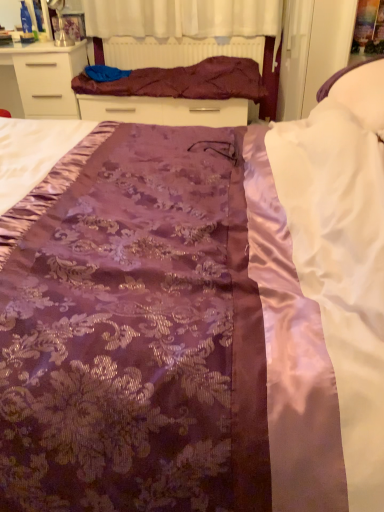
Describe the element at coordinates (41, 79) in the screenshot. I see `matte white chest of drawers at upper left` at that location.

This screenshot has height=512, width=384. What are the coordinates of `purple satin blanket at upper center` in the screenshot? It's located at (184, 81).

Where is `matte white chest of drawers at upper left`? This screenshot has width=384, height=512. matte white chest of drawers at upper left is located at coordinates (41, 79).

Based on the photo, considering the relative sizes of purple satin blanket at upper center and matte white chest of drawers at upper left in the image provided, is purple satin blanket at upper center smaller than matte white chest of drawers at upper left?

Yes.

Is purple satin blanket at upper center closer to the viewer compared to matte white chest of drawers at upper left?

Yes, purple satin blanket at upper center is in front of matte white chest of drawers at upper left.

From their relative heights in the image, would you say purple satin blanket at upper center is taller or shorter than matte white chest of drawers at upper left?

Clearly, purple satin blanket at upper center is shorter compared to matte white chest of drawers at upper left.

Considering the relative sizes of white satin pillow at upper right and purple satin blanket at upper center in the image provided, is white satin pillow at upper right thinner than purple satin blanket at upper center?

Indeed, white satin pillow at upper right has a lesser width compared to purple satin blanket at upper center.

Considering the sizes of white satin pillow at upper right and purple satin blanket at upper center in the image, is white satin pillow at upper right taller or shorter than purple satin blanket at upper center?

In the image, white satin pillow at upper right appears to be taller than purple satin blanket at upper center.

How many degrees apart are the facing directions of white satin pillow at upper right and purple satin blanket at upper center?

white satin pillow at upper right and purple satin blanket at upper center are facing 90.4 degrees away from each other.

From a real-world perspective, between white satin pillow at upper right and purple satin blanket at upper center, who is vertically lower?

From a 3D spatial view, purple satin blanket at upper center is below.

From a real-world perspective, is purple satin blanket at upper center located higher than purple satin bed frame at upper center?

Indeed, from a real-world perspective, purple satin blanket at upper center stands above purple satin bed frame at upper center.

From the image's perspective, which is above, purple satin blanket at upper center or purple satin bed frame at upper center?

purple satin bed frame at upper center appears higher in the image.

Between purple satin blanket at upper center and purple satin bed frame at upper center, which one has more height?

With more height is purple satin bed frame at upper center.

In the scene shown: Could you tell me if purple satin bed frame at upper center is facing purple satin blanket at upper center?

Yes, purple satin bed frame at upper center faces towards purple satin blanket at upper center.

How much distance is there between purple satin bed frame at upper center and purple satin blanket at upper center?

purple satin bed frame at upper center is 15.29 inches away from purple satin blanket at upper center.

Between purple satin bed frame at upper center and purple satin blanket at upper center, which one is positioned behind?

purple satin bed frame at upper center.

Who is taller, purple satin bed frame at upper center or purple satin blanket at upper center?

Standing taller between the two is purple satin bed frame at upper center.

From a real-world perspective, which object stands above the other?

white satin pillow at upper right is physically above.

From the image's perspective, is white satin pillow at upper right on purple satin bed frame at upper center?

Incorrect, from the image's perspective, white satin pillow at upper right is lower than purple satin bed frame at upper center.

Is purple satin bed frame at upper center at the back of white satin pillow at upper right?

No, white satin pillow at upper right is not facing the opposite direction of purple satin bed frame at upper center.

Is white satin pillow at upper right to the right of purple satin bed frame at upper center from the viewer's perspective?

Yes, white satin pillow at upper right is to the right of purple satin bed frame at upper center.

From a real-world perspective, between matte white chest of drawers at upper left and white satin pillow at upper right, who is vertically higher?

white satin pillow at upper right, from a real-world perspective.

Which object is further away from the camera, matte white chest of drawers at upper left or white satin pillow at upper right?

matte white chest of drawers at upper left is behind.

You are a GUI agent. You are given a task and a screenshot of the screen. Output one action in this format:
    pyautogui.click(x=<x>, y=<y>)
    Task: Click on the chest of drawers located behind the white satin pillow at upper right
    
    Given the screenshot: What is the action you would take?
    [41, 79]

Considering the relative sizes of purple satin bed frame at upper center and white satin pillow at upper right in the image provided, is purple satin bed frame at upper center smaller than white satin pillow at upper right?

Yes.

Which is less distant, (269, 42) or (382, 131)?

Point (269, 42) is farther from the camera than point (382, 131).

Who is taller, purple satin bed frame at upper center or white satin pillow at upper right?

purple satin bed frame at upper center is taller.

From a real-world perspective, which object stands above the other?

white satin pillow at upper right is physically above.

Where is `the chest of drawers directly beneath the purple satin blanket at upper center (from a real-world perspective)`? This screenshot has height=512, width=384. the chest of drawers directly beneath the purple satin blanket at upper center (from a real-world perspective) is located at coordinates coord(41,79).

The width and height of the screenshot is (384, 512). Identify the location of blanket on the left of the white satin pillow at upper right. (184, 81).

From the image, which object appears to be nearer to purple satin bed frame at upper center, matte white chest of drawers at upper left or white satin pillow at upper right?

white satin pillow at upper right is closer to purple satin bed frame at upper center.

From the picture: Looking at the image, which one is located closer to purple satin bed frame at upper center, matte white chest of drawers at upper left or purple satin blanket at upper center?

purple satin blanket at upper center is positioned closer to the anchor purple satin bed frame at upper center.

Looking at the image, which one is located closer to purple satin blanket at upper center, white satin pillow at upper right or purple satin bed frame at upper center?

purple satin bed frame at upper center lies closer to purple satin blanket at upper center than the other object.

Which object lies nearer to the anchor point white satin pillow at upper right, purple satin blanket at upper center or purple satin bed frame at upper center?

The object closer to white satin pillow at upper right is purple satin bed frame at upper center.

Estimate the real-world distances between objects in this image. Which object is closer to matte white chest of drawers at upper left, purple satin blanket at upper center or purple satin bed frame at upper center?

purple satin blanket at upper center is positioned closer to the anchor matte white chest of drawers at upper left.

Which object lies further to the anchor point matte white chest of drawers at upper left, purple satin bed frame at upper center or white satin pillow at upper right?

The object further to matte white chest of drawers at upper left is white satin pillow at upper right.

Based on their spatial positions, is white satin pillow at upper right or purple satin bed frame at upper center closer to matte white chest of drawers at upper left?

Among the two, purple satin bed frame at upper center is located nearer to matte white chest of drawers at upper left.

Based on their spatial positions, is matte white chest of drawers at upper left or purple satin bed frame at upper center closer to purple satin blanket at upper center?

purple satin bed frame at upper center is closer to purple satin blanket at upper center.

Image resolution: width=384 pixels, height=512 pixels. In order to click on blanket positioned between white satin pillow at upper right and matte white chest of drawers at upper left from near to far in this screenshot , I will do `click(184, 81)`.

You are a GUI agent. You are given a task and a screenshot of the screen. Output one action in this format:
    pyautogui.click(x=<x>, y=<y>)
    Task: Click on the chest of drawers between white satin pillow at upper right and purple satin bed frame at upper center along the z-axis
    This screenshot has width=384, height=512.
    Given the screenshot: What is the action you would take?
    pyautogui.click(x=41, y=79)

I want to click on blanket located between white satin pillow at upper right and purple satin bed frame at upper center in the depth direction, so click(184, 81).

Find the location of a particular element. The width and height of the screenshot is (384, 512). blanket between matte white chest of drawers at upper left and purple satin bed frame at upper center from left to right is located at coordinates (184, 81).